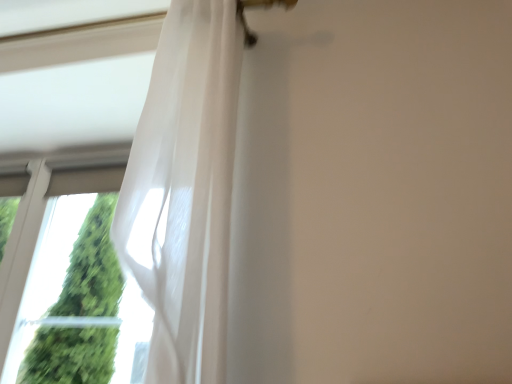
Measure the distance between point (165, 292) and camera.

A distance of 28.11 inches exists between point (165, 292) and camera.

Locate an element on the screen. The height and width of the screenshot is (384, 512). sheer white curtain at left is located at coordinates pos(184,191).

This screenshot has width=512, height=384. What do you see at coordinates (184, 191) in the screenshot?
I see `sheer white curtain at left` at bounding box center [184, 191].

This screenshot has width=512, height=384. Find the location of `sheer white curtain at left`. sheer white curtain at left is located at coordinates (184, 191).